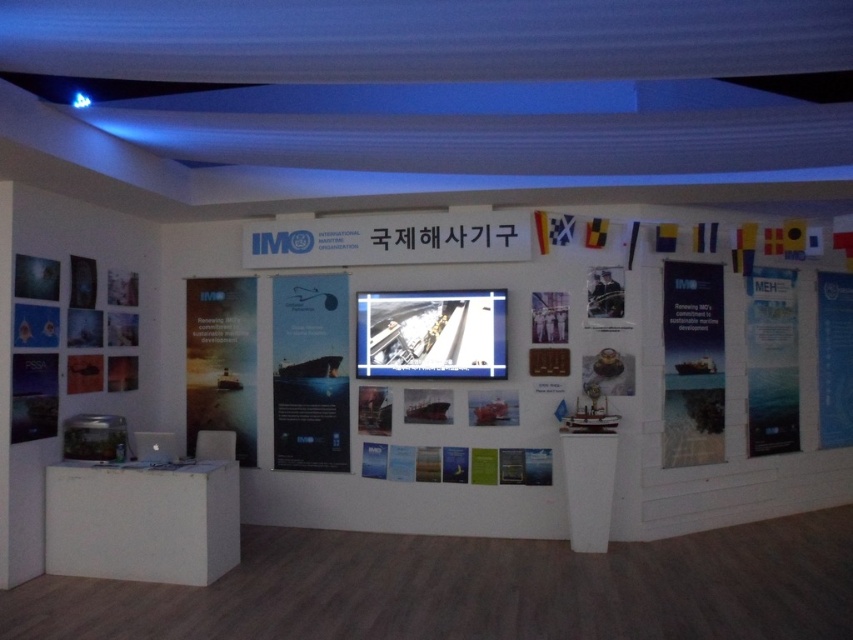
You are an attendee at the IMO exhibition and want to read both the matte paper poster at center and the blue paper at upper right. Which one should you stand closer to first if you want to read them in the order they are displayed from left to right?

Since the matte paper poster at center is to the left of the blue paper at upper right, you should first stand closer to the matte paper poster at center to read them in the correct left to right order.

You are an event organizer setting up a booth at the IMO exhibition. You have two materials to display on the wall. The matte paper poster at center and the blue paper at upper right. Which one has a larger size?

The blue paper at upper right is larger than the matte paper poster at center.